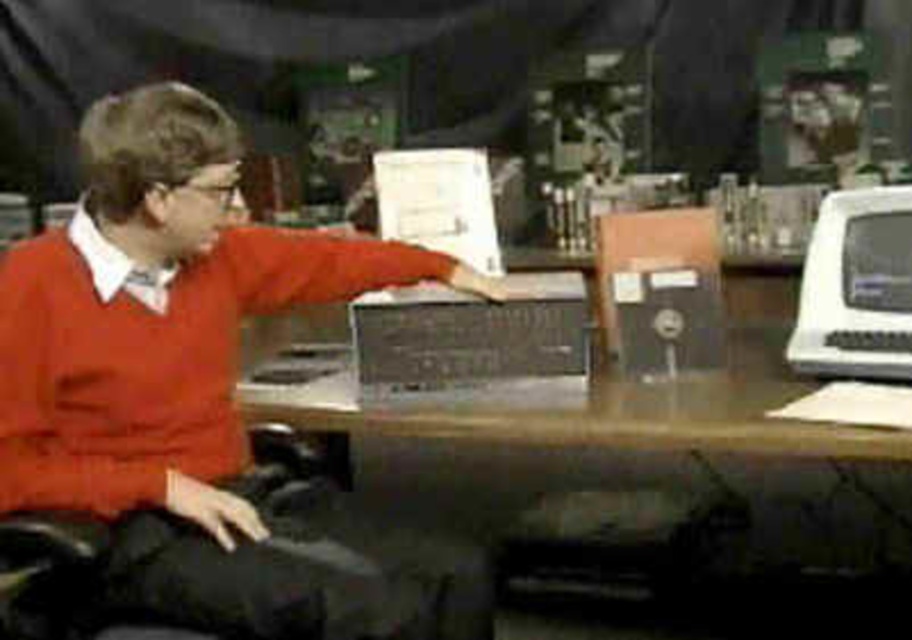
Question: Which point is farther to the camera?

Choices:
 (A) matte orange sweater at center
 (B) shiny black monitor at right

Answer: (B)

Question: Does white plastic desktop computer at right have a lesser width compared to shiny black monitor at right?

Choices:
 (A) no
 (B) yes

Answer: (A)

Question: Which of these objects is positioned farthest from the matte orange sweater at center?

Choices:
 (A) metallic silver laptop at center
 (B) shiny black monitor at right

Answer: (B)

Question: Is wooden at center above white plastic desktop computer at right?

Choices:
 (A) no
 (B) yes

Answer: (A)

Question: Based on their relative distances, which object is nearer to the white plastic desktop computer at right?

Choices:
 (A) shiny black monitor at right
 (B) matte orange sweater at center
 (C) wooden at center
 (D) metallic silver laptop at center

Answer: (A)

Question: Does matte orange sweater at center have a greater width compared to metallic silver laptop at center?

Choices:
 (A) no
 (B) yes

Answer: (B)